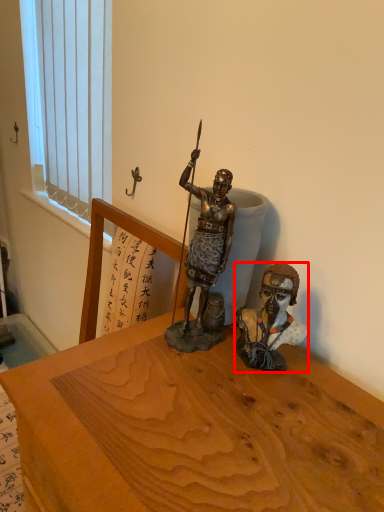
Question: From the image's perspective, where is person (annotated by the red box) located relative to window?

Choices:
 (A) above
 (B) below

Answer: (B)